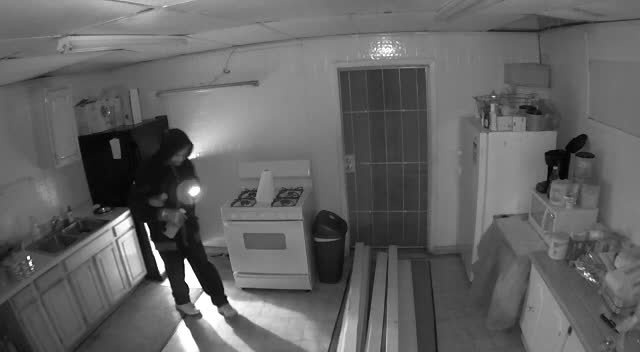
At what (x,y) coordinates should I click in order to perform the action: click on side of refrigerator. Please return your answer as a coordinate pair (x, y). Looking at the image, I should click on (514, 176).